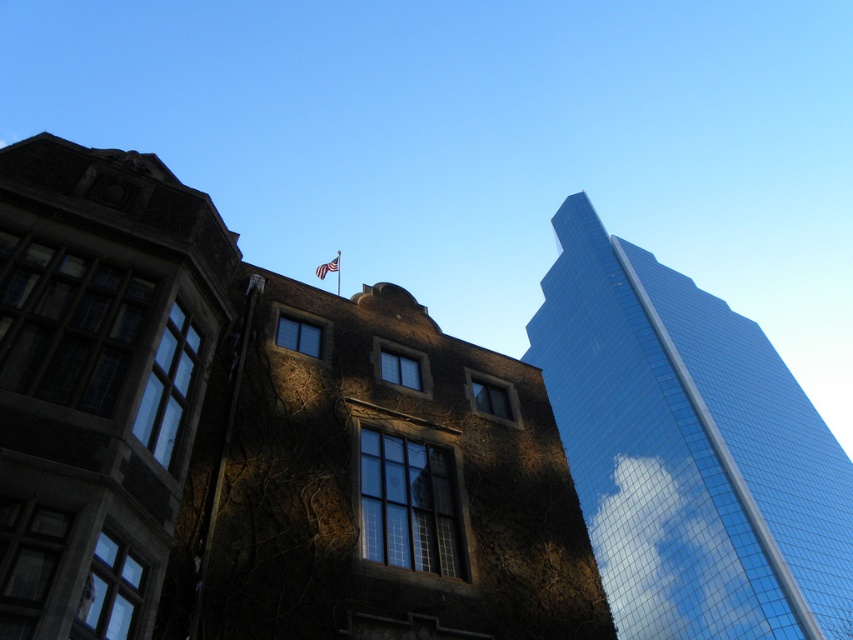
Based on the photo, you are an architect analyzing the image. You need to determine which object occupies more horizontal space in the scene. Based on the scene description, which object is wider between the shiny glass skyscraper at right and the american flag at upper center?

The shiny glass skyscraper at right is wider than the american flag at upper center according to the description.

From the picture: You are standing at the base of the historic building on the left. You want to walk straight towards the shiny glass skyscraper at right. Will you pass by the american flag at upper center before reaching the skyscraper?

The distance from the shiny glass skyscraper at right to the american flag at upper center is 102.98 meters. Since you are starting at the historic building on the left, which is opposite the skyscraper, the flag is above and between you and the skyscraper. Therefore, you would pass by the american flag at upper center before reaching the shiny glass skyscraper at right.

You are standing in the middle of the street between the historic building on the left and the modern skyscraper on the right. You see two points marked in the image. Which point is closer to you, point (666, 472) or point (337, 262)?

Point (666, 472) is closer to you than point (337, 262) because it is further to the viewer in the image.